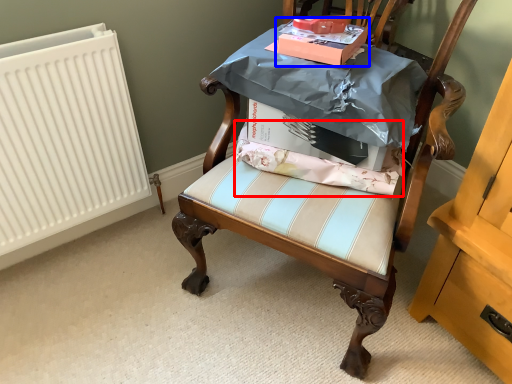
Question: Which object is further to the camera taking this photo, fabric (highlighted by a red box) or cardboard box (highlighted by a blue box)?

Choices:
 (A) fabric
 (B) cardboard box

Answer: (A)